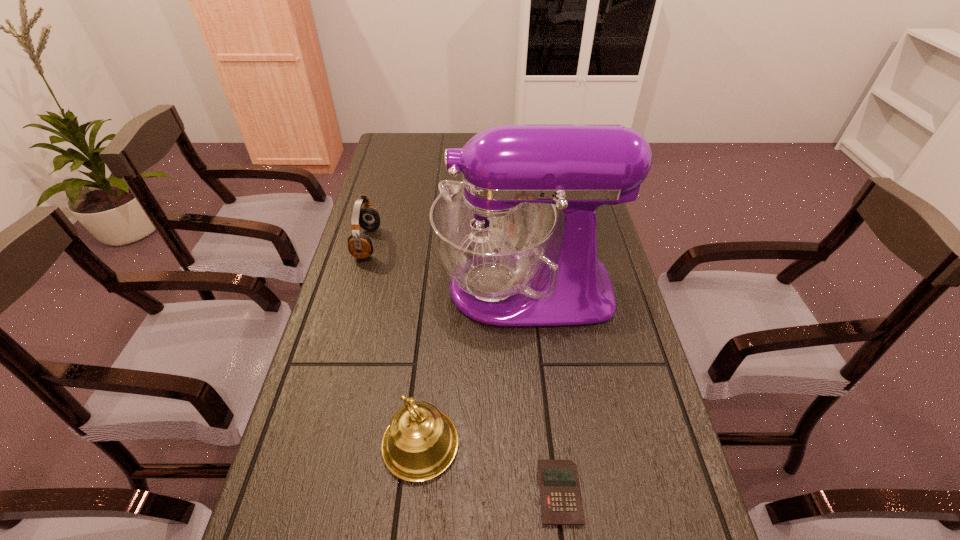
Find the location of a particular element. The image size is (960, 540). empty space that is in between the headset and the calculator is located at coordinates (464, 368).

In order to click on free space between the shortest object and the second shortest object in this screenshot , I will do [x=464, y=368].

Image resolution: width=960 pixels, height=540 pixels. Find the location of `unoccupied area between the shortest object and the third shortest object`. unoccupied area between the shortest object and the third shortest object is located at coordinates (490, 469).

Locate an element on the screen. Image resolution: width=960 pixels, height=540 pixels. vacant space that's between the third tallest object and the second tallest object is located at coordinates (394, 344).

Find the location of a particular element. The height and width of the screenshot is (540, 960). vacant space in between the headset and the bell is located at coordinates (394, 344).

Where is `object identified as the third closest to the leftmost object`? This screenshot has height=540, width=960. object identified as the third closest to the leftmost object is located at coordinates (561, 503).

Find the location of a particular element. the second closest object to the mixer is located at coordinates (421, 442).

Locate an element on the screen. free spot that satisfies the following two spatial constraints: 1. on the ear cups of the headset; 2. on the left side of the second tallest object is located at coordinates (311, 444).

Where is `free space that satisfies the following two spatial constraints: 1. on the ear cups of the bell; 2. on the left side of the headset`? free space that satisfies the following two spatial constraints: 1. on the ear cups of the bell; 2. on the left side of the headset is located at coordinates (311, 444).

I want to click on blank space that satisfies the following two spatial constraints: 1. on the ear cups of the leftmost object; 2. on the left side of the calculator, so click(298, 492).